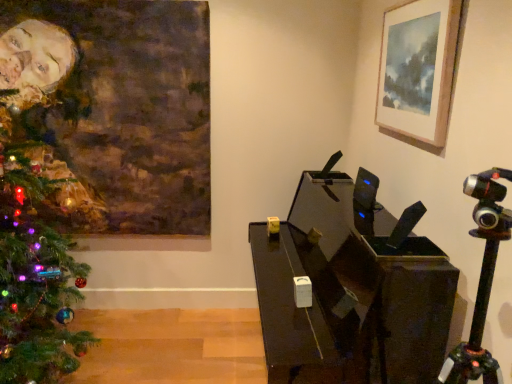
Image resolution: width=512 pixels, height=384 pixels. I want to click on free spot above oil painting portrait at left, the first picture frame in the back-to-front sequence (from a real-world perspective), so tap(110, 3).